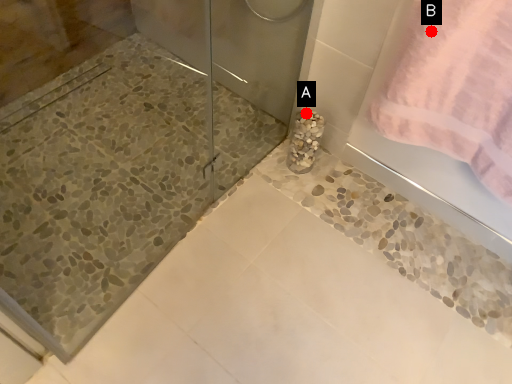
Question: Two points are circled on the image, labeled by A and B beside each circle. Which point appears farthest from the camera in this image?

Choices:
 (A) A is further
 (B) B is further

Answer: (A)